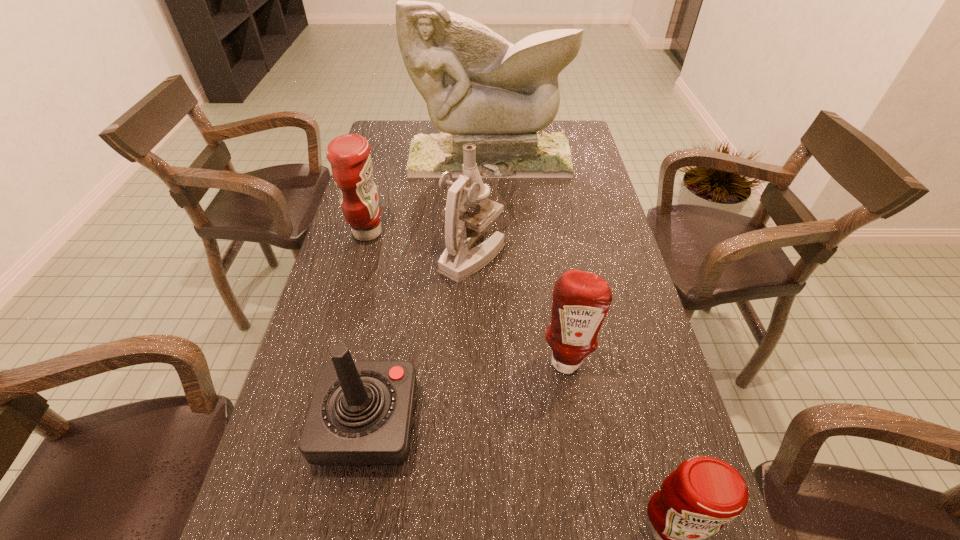
Locate an element on the screen. This screenshot has width=960, height=540. vacant space at the left edge of the desktop is located at coordinates (372, 289).

In the image, there is a desktop. Where is `vacant space at the right edge`? vacant space at the right edge is located at coordinates (670, 386).

Identify the location of vacant area that lies between the farthest condiment and the microscope. (420, 244).

Where is `empty location between the farthest condiment and the second condiment from left to right`? Image resolution: width=960 pixels, height=540 pixels. empty location between the farthest condiment and the second condiment from left to right is located at coordinates (467, 296).

Identify the location of vacant space that's between the microscope and the leftmost condiment. (420, 244).

Where is `free space between the second condiment from left to right and the joystick`? This screenshot has width=960, height=540. free space between the second condiment from left to right and the joystick is located at coordinates (467, 392).

Identify which object is the closest to the leftmost condiment. Please provide its 2D coordinates. Your answer should be formatted as a tuple, i.e. [(x, y)], where the tuple contains the x and y coordinates of a point satisfying the conditions above.

[(463, 228)]

I want to click on the second closest object to the farthest object, so click(x=463, y=228).

At what (x,y) coordinates should I click in order to perform the action: click on the second closest condiment to the leftmost condiment. Please return your answer as a coordinate pair (x, y). Looking at the image, I should click on (694, 502).

Identify the location of condiment that is the second closest to the leftmost condiment. This screenshot has width=960, height=540. (694, 502).